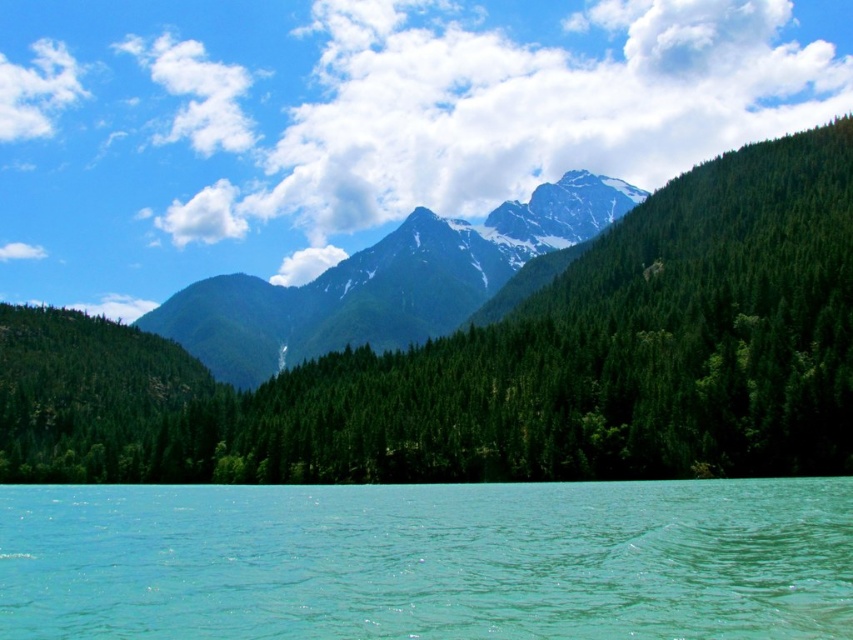
Is turquoise glassy water at lower center thinner than snowy rocky mountain range at center?

Yes.

Does turquoise glassy water at lower center have a greater width compared to snowy rocky mountain range at center?

In fact, turquoise glassy water at lower center might be narrower than snowy rocky mountain range at center.

Identify the location of turquoise glassy water at lower center. (428, 561).

Can you confirm if green matte forest at center is positioned to the right of turquoise glassy water at lower center?

Incorrect, green matte forest at center is not on the right side of turquoise glassy water at lower center.

Between point (698, 180) and point (201, 624), which one is positioned in front?

Point (201, 624) is in front.

Where is `green matte forest at center`? Image resolution: width=853 pixels, height=640 pixels. green matte forest at center is located at coordinates (509, 364).

Who is positioned more to the left, green matte forest at center or snowy rocky mountain range at center?

green matte forest at center

Locate an element on the screen. This screenshot has width=853, height=640. green matte forest at center is located at coordinates (509, 364).